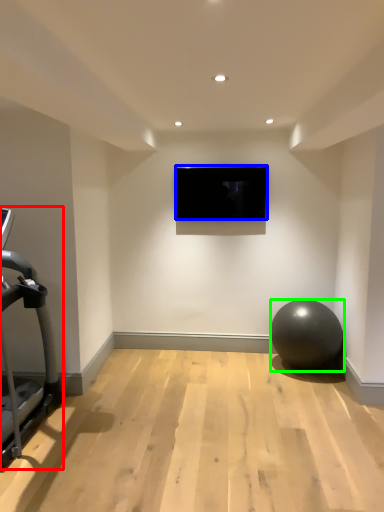
Question: Which object is the closest to the treadmill (highlighted by a red box)? Choose among these: television (highlighted by a blue box) or ball (highlighted by a green box).

Choices:
 (A) television
 (B) ball

Answer: (A)